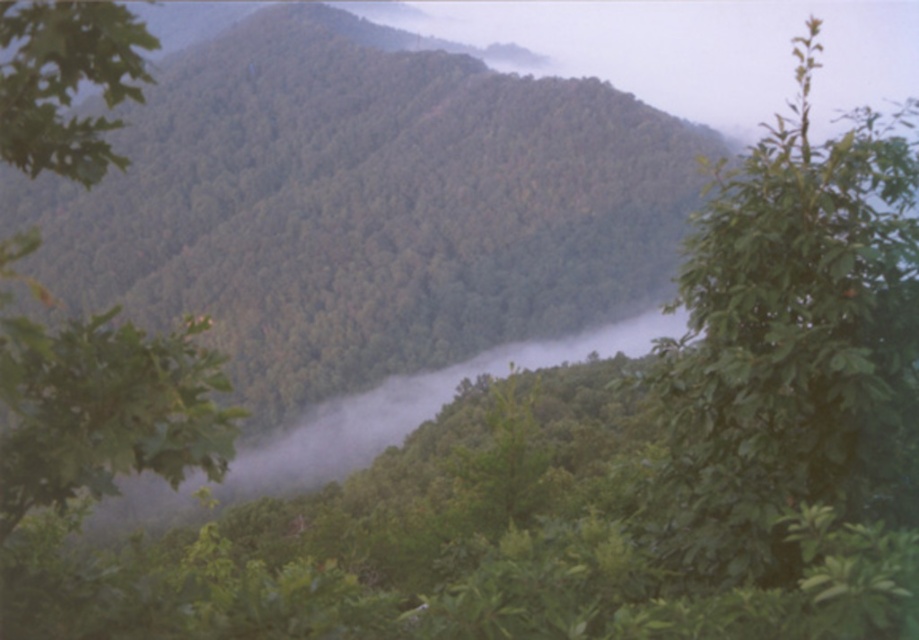
Question: From the image, what is the correct spatial relationship of green leafy tree at right in relation to green leafy tree at upper left?

Choices:
 (A) above
 (B) below

Answer: (A)

Question: Is green leafy tree at right to the left of green leafy tree at upper left from the viewer's perspective?

Choices:
 (A) yes
 (B) no

Answer: (B)

Question: Which of the following is the farthest from the observer?

Choices:
 (A) green leafy tree at upper left
 (B) green leafy tree at right

Answer: (B)

Question: Does green leafy tree at right have a larger size compared to green leafy tree at upper left?

Choices:
 (A) yes
 (B) no

Answer: (A)

Question: Which of the following is the closest to the observer?

Choices:
 (A) (24, 44)
 (B) (702, 333)

Answer: (A)